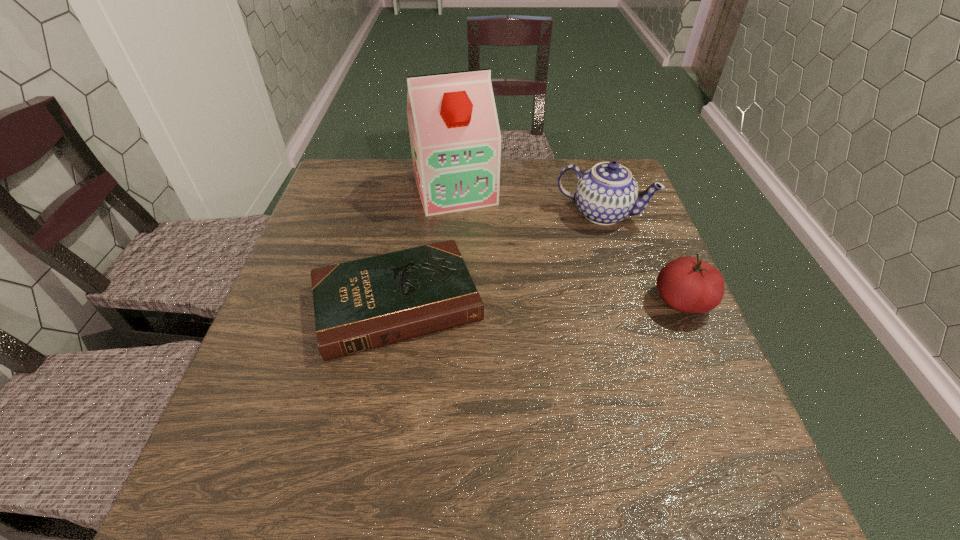
Locate an element on the screen. the shortest object is located at coordinates (359, 305).

This screenshot has width=960, height=540. Identify the location of the second shortest object. (687, 284).

You are a GUI agent. You are given a task and a screenshot of the screen. Output one action in this format:
    pyautogui.click(x=<x>, y=<y>)
    Task: Click on the chinaware
    
    Given the screenshot: What is the action you would take?
    pyautogui.click(x=607, y=193)

Identify the location of soya milk. (455, 137).

You are a GUI agent. You are given a task and a screenshot of the screen. Output one action in this format:
    pyautogui.click(x=<x>, y=<y>)
    Task: Click on the free space located on the back of the Bible
    The height and width of the screenshot is (540, 960).
    Given the screenshot: What is the action you would take?
    pyautogui.click(x=419, y=178)

At what (x,y) coordinates should I click in order to perform the action: click on vacant position located on the left of the tomato. Please return your answer as a coordinate pair (x, y). The height and width of the screenshot is (540, 960). Looking at the image, I should click on (592, 302).

Locate an element on the screen. This screenshot has height=540, width=960. vacant space positioned 0.390m at the spout of the third shortest object is located at coordinates (540, 343).

The width and height of the screenshot is (960, 540). Identify the location of vacant region located 0.290m at the spout of the third shortest object. (555, 309).

I want to click on vacant space located at the spout of the third shortest object, so click(x=565, y=285).

At what (x,y) coordinates should I click in order to perform the action: click on free region located 0.400m with the cap open on the soya milk. Please return your answer as a coordinate pair (x, y). The width and height of the screenshot is (960, 540). Looking at the image, I should click on (510, 329).